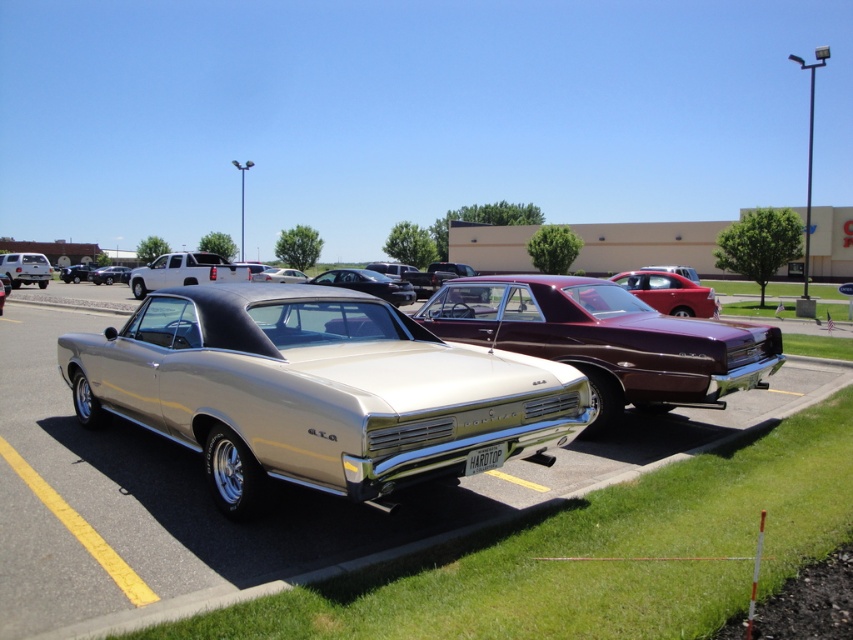
Is point (405, 353) in front of point (194, 253)?

Yes, it is in front of point (194, 253).

Which is behind, point (215, 456) or point (189, 273)?

Point (189, 273)

Does point (544, 419) come closer to viewer compared to point (201, 262)?

Yes.

Find the location of `metallic gold convertible at center`. metallic gold convertible at center is located at coordinates (316, 390).

Is shiny maroon car at center above matte white truck at left?

Actually, shiny maroon car at center is below matte white truck at left.

Which is more to the right, shiny maroon car at center or matte white truck at left?

Positioned to the right is shiny maroon car at center.

Between point (679, 275) and point (1, 266), which one is positioned behind?

The point (1, 266) is more distant.

The image size is (853, 640). In order to click on shiny maroon car at center in this screenshot , I will do (x=668, y=292).

Who is higher up, shiny silver sedan at center or shiny gold car at center?

shiny silver sedan at center is higher up.

The height and width of the screenshot is (640, 853). What do you see at coordinates (109, 275) in the screenshot?
I see `shiny silver sedan at center` at bounding box center [109, 275].

Is point (96, 282) positioned before point (6, 291)?

No, it is not.

At what (x,y) coordinates should I click in order to perform the action: click on shiny silver sedan at center. Please return your answer as a coordinate pair (x, y). Looking at the image, I should click on (109, 275).